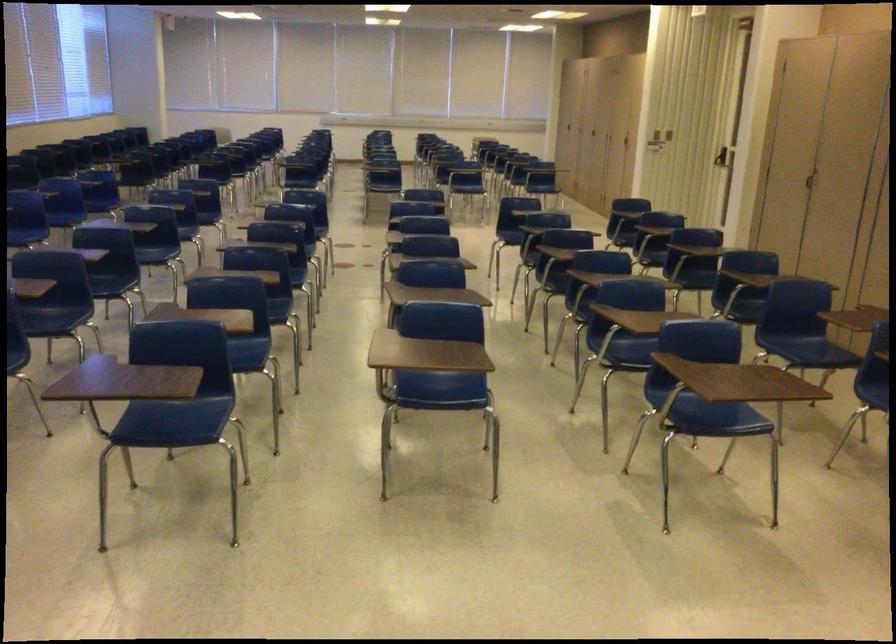
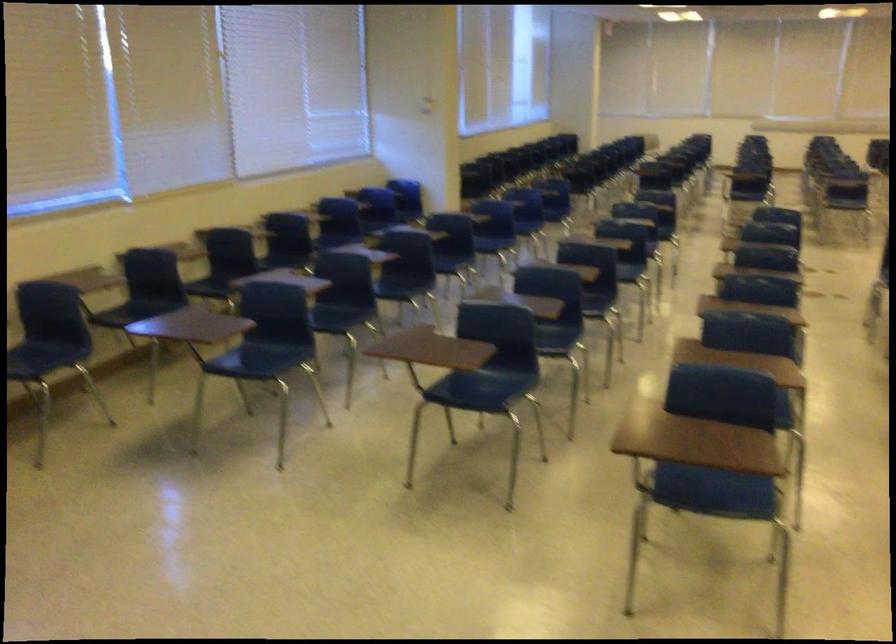
Question: How did the camera likely rotate?

Choices:
 (A) Left
 (B) Right
 (C) Up
 (D) Down

Answer: (A)